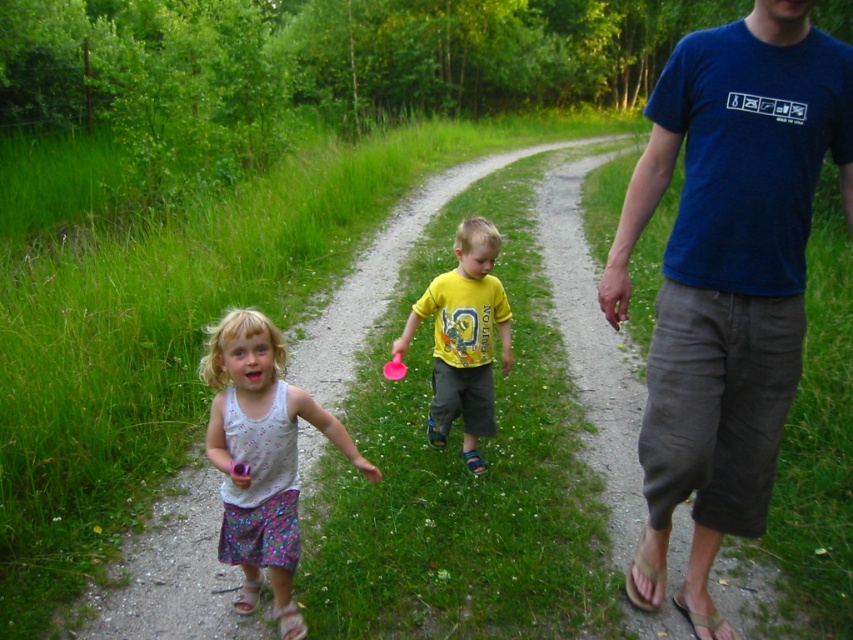
Question: Can you confirm if blue cotton t-shirt at center is bigger than yellow matte shirt at center?

Choices:
 (A) yes
 (B) no

Answer: (A)

Question: Which point is closer to the camera?

Choices:
 (A) (392, 365)
 (B) (241, 355)

Answer: (B)

Question: Can you confirm if blue cotton t-shirt at center is thinner than pink rubber ball at center?

Choices:
 (A) no
 (B) yes

Answer: (A)

Question: Considering the real-world distances, which object is closest to the blue cotton t-shirt at center?

Choices:
 (A) yellow matte shirt at center
 (B) pink rubber ball at center
 (C) white printed tank top at center

Answer: (A)

Question: Estimate the real-world distances between objects in this image. Which object is closer to the white printed tank top at center?

Choices:
 (A) pink rubber ball at center
 (B) blue cotton t-shirt at center
 (C) yellow matte shirt at center

Answer: (A)

Question: Can you confirm if blue cotton t-shirt at center is bigger than yellow matte shirt at center?

Choices:
 (A) yes
 (B) no

Answer: (A)